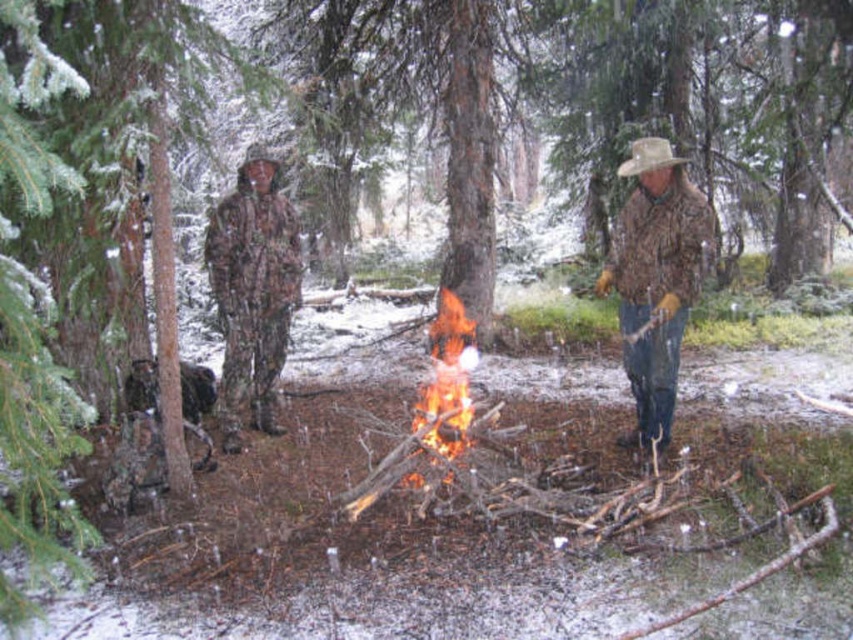
You are planning to take a winter hike and need to decide between two camouflage outfits available in the scene. The camouflage jacket at center and the camouflage fabric suit at center. Based on their sizes, which one would you choose if you want the bigger option?

The camouflage jacket at center has a larger size compared to the camouflage fabric suit at center, so you should choose the camouflage jacket at center for the bigger option.

You are planning to take a photo of the flaming wood at center and the camouflage fabric suit at center. Based on their positions, which object should you focus on first if you want to capture both in a single frame without moving the camera?

The camouflage fabric suit at center is positioned on the left side of flaming wood at center, so you should focus on the camouflage fabric suit at center first to ensure both are in frame.